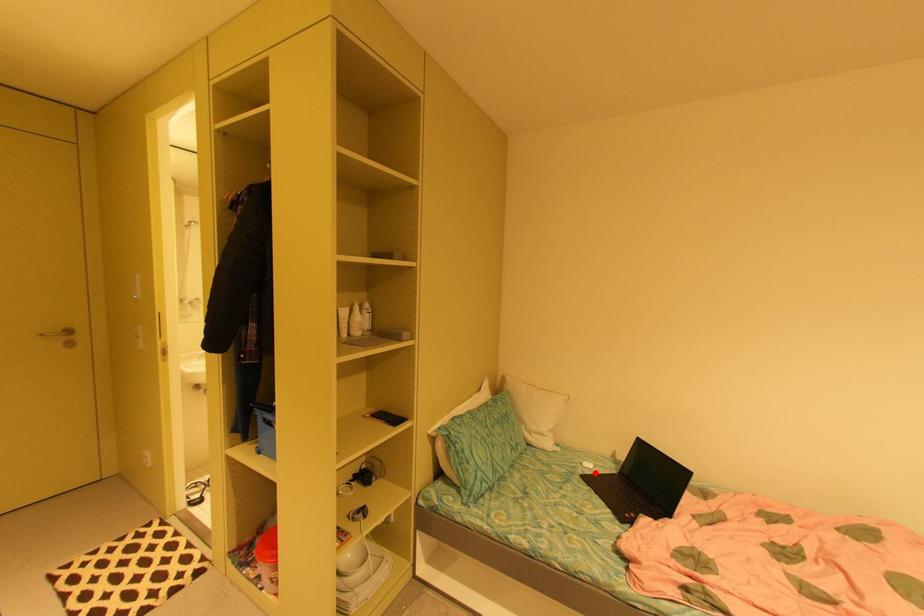
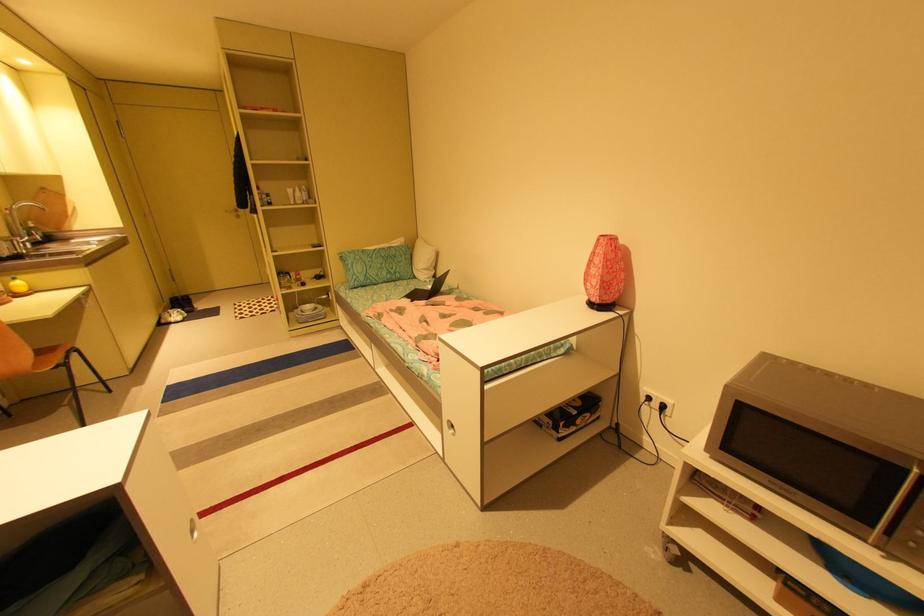
Question: I am providing you with two images of the same scene from different viewpoints. In image1, a red point is highlighted. Considering the same 3D point in image2, which of the following is correct?

Choices:
 (A) It is closer
 (B) It is farther

Answer: (B)